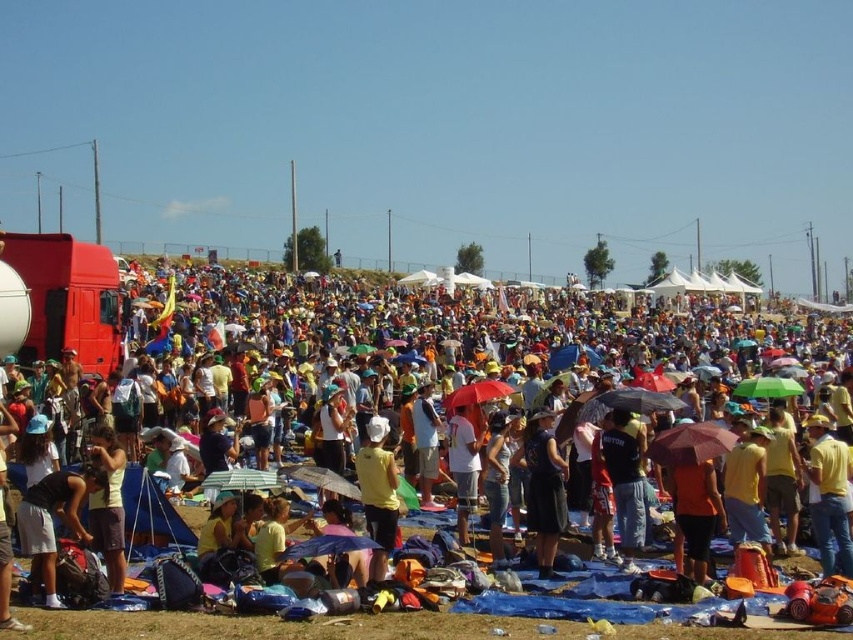
Which of these two, black dress at center or blue fabric umbrella at center, stands taller?

black dress at center

Who is lower down, black dress at center or blue fabric umbrella at center?

blue fabric umbrella at center is below.

Between point (544, 513) and point (358, 540), which one is positioned behind?

The point (544, 513) is more distant.

Find the location of `black dress at center`. black dress at center is located at coordinates (543, 486).

Image resolution: width=853 pixels, height=640 pixels. Describe the element at coordinates (502, 330) in the screenshot. I see `yellow fabric umbrella at center` at that location.

Is point (798, 324) positioned after point (376, 456)?

Yes.

Identify the location of yellow fabric umbrella at center. This screenshot has width=853, height=640. (502, 330).

Who is more distant from viewer, (x=579, y=484) or (x=550, y=492)?

The point (x=579, y=484) is behind.

Does yellow fabric umbrella at center have a lesser width compared to black dress at center?

No, yellow fabric umbrella at center is not thinner than black dress at center.

Does point (207, 310) lie in front of point (541, 477)?

No, (207, 310) is further to viewer.

Image resolution: width=853 pixels, height=640 pixels. Identify the location of yellow fabric umbrella at center. (502, 330).